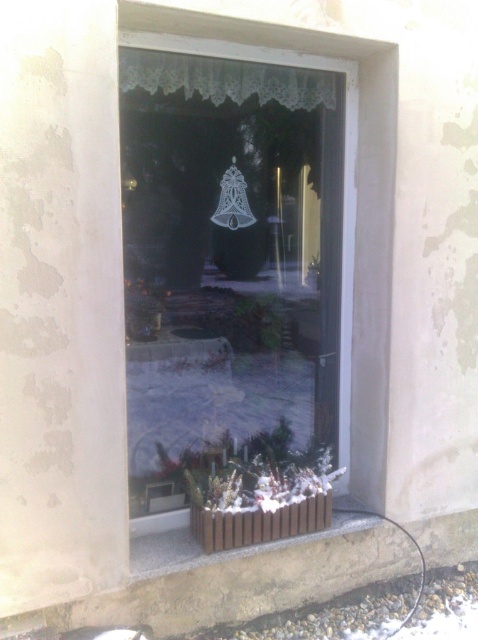
Question: Which point is closer to the camera taking this photo?

Choices:
 (A) (307, 200)
 (B) (205, 60)

Answer: (B)

Question: Which of the following is the closest to the observer?

Choices:
 (A) transparent glass bell at center
 (B) brown wooden curb at lower center
 (C) white lace curtain at upper center

Answer: (B)

Question: Which object is the closest to the white lace curtain at upper center?

Choices:
 (A) transparent glass bell at center
 (B) brown wooden curb at lower center

Answer: (A)

Question: Is transparent glass bell at center thinner than white lace curtain at upper center?

Choices:
 (A) no
 (B) yes

Answer: (A)

Question: From the image, what is the correct spatial relationship of transparent glass bell at center in relation to white lace curtain at upper center?

Choices:
 (A) above
 (B) below

Answer: (B)

Question: Does transparent glass bell at center lie in front of brown wooden curb at lower center?

Choices:
 (A) yes
 (B) no

Answer: (B)